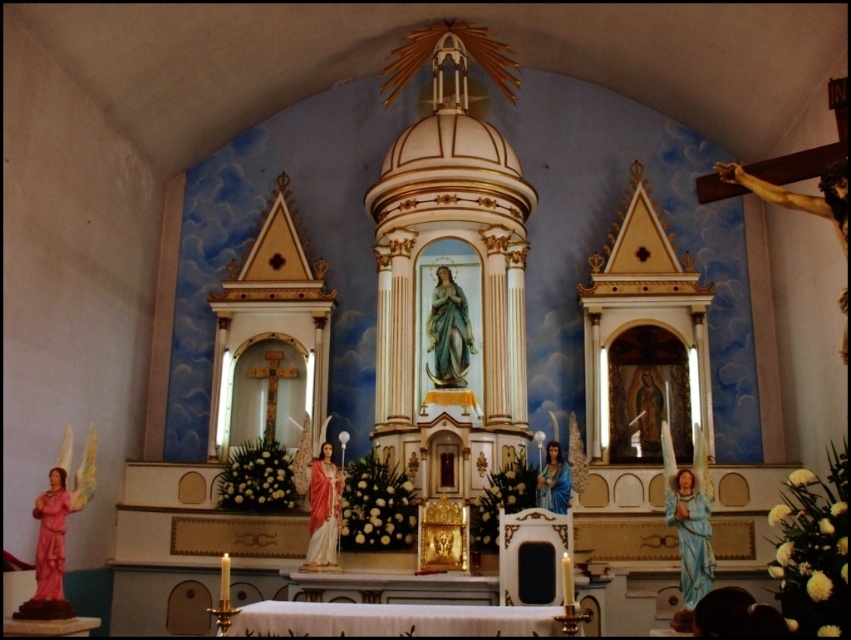
Question: Can you confirm if pink glossy statue at lower left is smaller than wooden statue of jesus at center?

Choices:
 (A) yes
 (B) no

Answer: (B)

Question: Which object is farther from the camera taking this photo?

Choices:
 (A) wooden crucifix at right
 (B) blue glossy statue at lower right

Answer: (B)

Question: Can you confirm if matte gold statue at center is thinner than wooden statue of jesus at center?

Choices:
 (A) no
 (B) yes

Answer: (A)

Question: Can you confirm if matte gold statue at center is thinner than blue glossy statue at center?

Choices:
 (A) no
 (B) yes

Answer: (A)

Question: Which point is farther from the camera taking this photo?

Choices:
 (A) (318, 534)
 (B) (697, 529)

Answer: (A)

Question: Which point is closer to the camera taking this photo?

Choices:
 (A) (557, 467)
 (B) (646, 387)

Answer: (A)